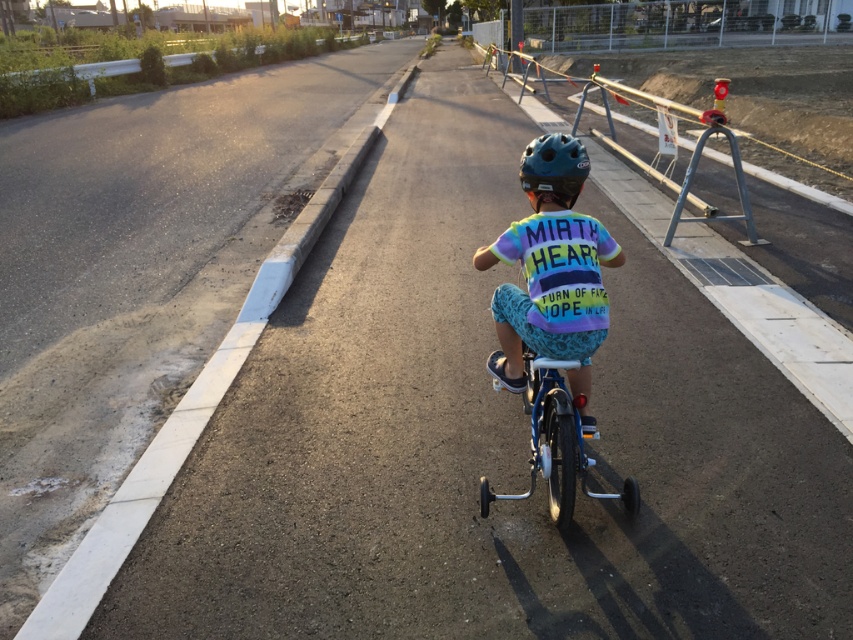
You are a photographer wanting to capture the child in the scene. Since the multicolored jersey at center and the blue metallic bicycle at center are both in the frame, which object should you focus on to ensure the subject is clearly visible given their sizes?

The multicolored jersey at center has a lesser width compared to the blue metallic bicycle at center, so focusing on the blue metallic bicycle at center would ensure the subject is clearly visible due to its larger size.

You are a pedestrian walking along the path and see the multicolored jersey at center and the metallic silver rail at upper right. Which object is higher from the ground?

The metallic silver rail at upper right is higher from the ground than the multicolored jersey at center.

You are a photographer standing at the camera position. The multicolored jersey at center is part of a cycling event. You need to capture a photo where the jersey is clearly visible. Considering the distance between the camera and the jersey, can you estimate if you can clearly capture the jersey from your current position?

The multicolored jersey at center and camera are 2.90 meters apart. At this distance, it should be possible to capture a clear photo of the jersey as long as the camera has a sufficient zoom or the photographer moves closer if needed.